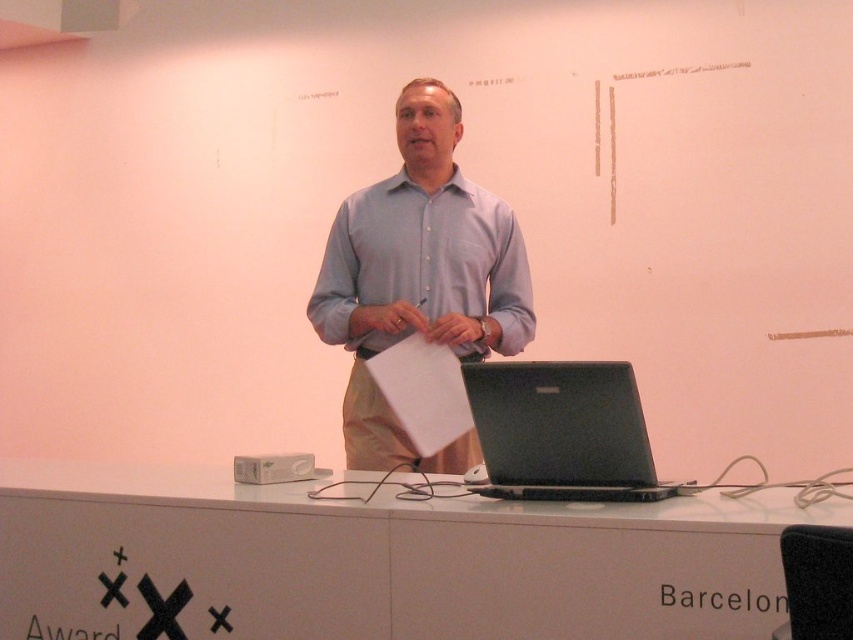
Question: Is light blue shirt at center positioned in front of black matte laptop at center?

Choices:
 (A) yes
 (B) no

Answer: (B)

Question: Which object is farther from the camera taking this photo?

Choices:
 (A) white glossy table at center
 (B) light blue shirt at center
 (C) black matte laptop at center

Answer: (B)

Question: Which of these objects is positioned farthest from the light blue shirt at center?

Choices:
 (A) black matte laptop at center
 (B) white glossy table at center

Answer: (A)

Question: Is white glossy table at center positioned before black matte laptop at center?

Choices:
 (A) no
 (B) yes

Answer: (B)

Question: Which is farther from the white glossy table at center?

Choices:
 (A) black matte laptop at center
 (B) light blue shirt at center

Answer: (B)

Question: Is light blue shirt at center below black matte laptop at center?

Choices:
 (A) yes
 (B) no

Answer: (B)